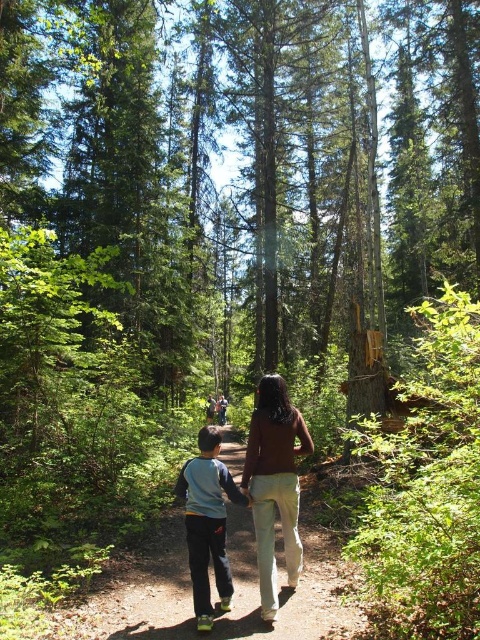
Between brown matte shirt at center and light blue fleece at center, which one is positioned higher?

brown matte shirt at center is above.

Does brown matte shirt at center have a lesser width compared to light blue fleece at center?

Yes, brown matte shirt at center is thinner than light blue fleece at center.

Is point (264, 588) positioned before point (197, 545)?

Yes, point (264, 588) is in front of point (197, 545).

I want to click on brown matte shirt at center, so click(275, 484).

This screenshot has height=640, width=480. What are the coordinates of `dirt path at center` in the screenshot? It's located at (233, 595).

Which is in front, point (238, 592) or point (297, 493)?

Positioned in front is point (297, 493).

The width and height of the screenshot is (480, 640). In order to click on dirt path at center in this screenshot , I will do (233, 595).

Does dirt path at center have a greater width compared to light blue fleece at center?

No, dirt path at center is not wider than light blue fleece at center.

Which is in front, point (331, 534) or point (205, 618)?

Point (205, 618) is more forward.

Is point (280, 637) farther from viewer compared to point (200, 515)?

No, (280, 637) is closer to viewer.

Locate an element on the screen. The width and height of the screenshot is (480, 640). dirt path at center is located at coordinates (233, 595).